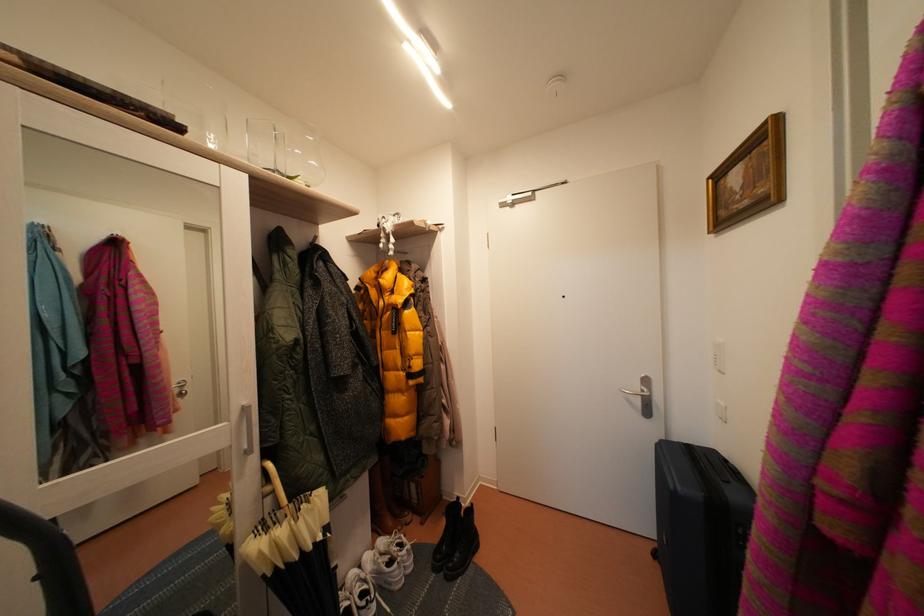
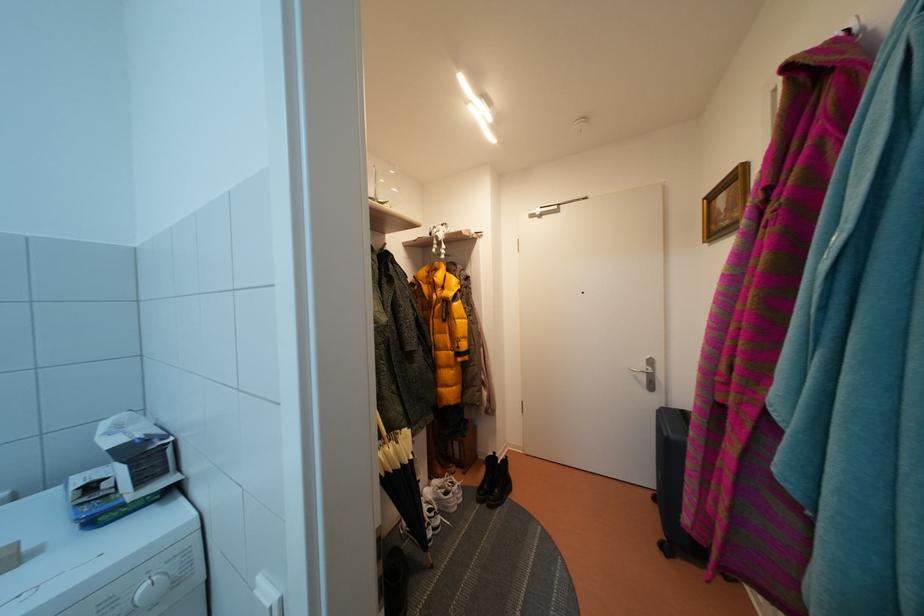
Find the pixel in the second image that matches [282,549] in the first image.

(393, 461)